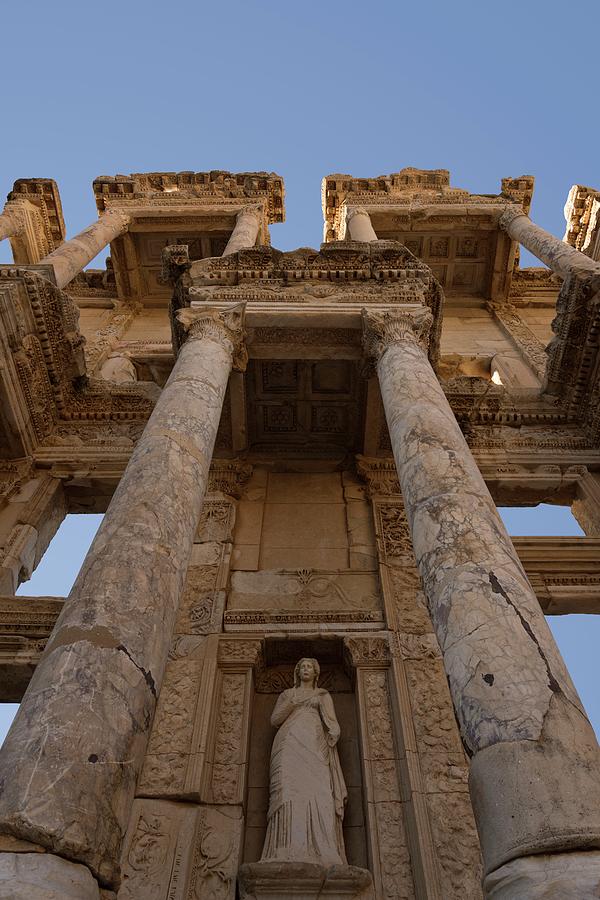
I want to click on left column, so click(87, 241), click(87, 670), click(362, 220).